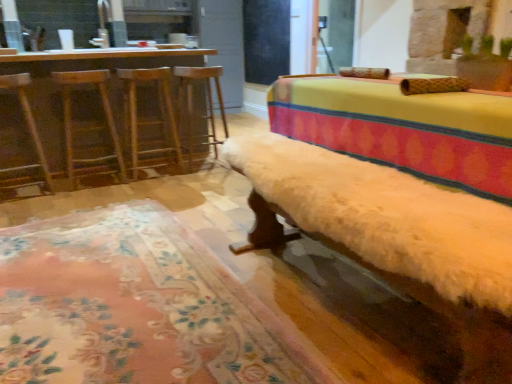
Find the location of `free space in front of wooden swivel chair at left, marked as the 2th swivel chair in a right-to-left arrangement`. free space in front of wooden swivel chair at left, marked as the 2th swivel chair in a right-to-left arrangement is located at coordinates (21, 209).